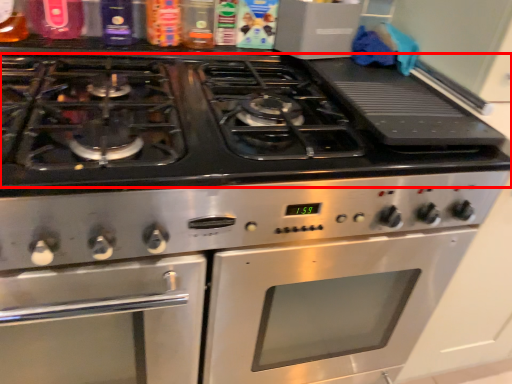
Question: From the image's perspective, what is the correct spatial relationship of gas stove (annotated by the red box) in relation to oven?

Choices:
 (A) above
 (B) below

Answer: (A)